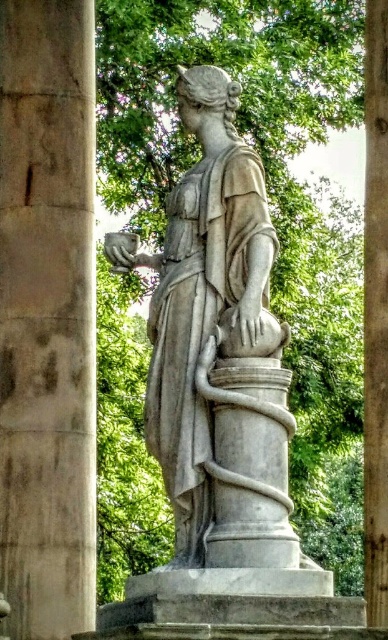
Based on the photo, can you confirm if smooth stone column at left is positioned to the left of brown wood post at right?

Indeed, smooth stone column at left is positioned on the left side of brown wood post at right.

Can you confirm if smooth stone column at left is taller than brown wood post at right?

Incorrect, smooth stone column at left's height is not larger of brown wood post at right's.

Describe the element at coordinates (46, 316) in the screenshot. I see `smooth stone column at left` at that location.

Locate an element on the screen. The width and height of the screenshot is (388, 640). smooth stone column at left is located at coordinates (46, 316).

Who is more distant from viewer, (180, 300) or (363, 212)?

Point (363, 212)

Image resolution: width=388 pixels, height=640 pixels. What do you see at coordinates (206, 307) in the screenshot? I see `white marble statue at center` at bounding box center [206, 307].

Identify the location of white marble statue at center. The height and width of the screenshot is (640, 388). (206, 307).

Is smooth stone column at left further to camera compared to white marble statue at center?

Yes.

Which is in front, point (69, 189) or point (204, 291)?

Point (204, 291)

Image resolution: width=388 pixels, height=640 pixels. Find the location of `smooth stone column at left`. smooth stone column at left is located at coordinates (46, 316).

This screenshot has height=640, width=388. In order to click on smooth stone column at left in this screenshot , I will do `click(46, 316)`.